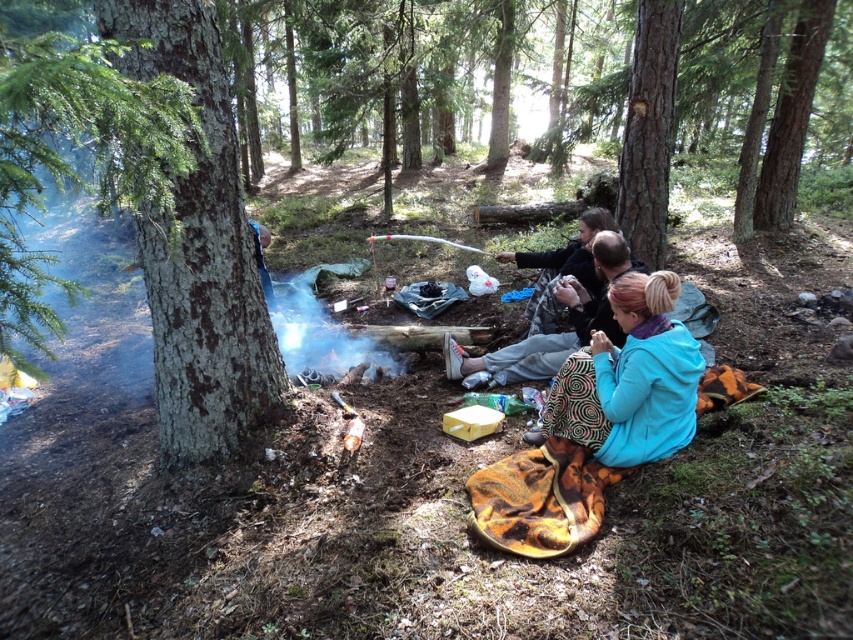
You are a hiker who wants to take a photo of the smooth bark tree at left and the teal fabric jacket at lower right together in the same frame. Based on their positions, will you need to adjust your camera angle to include both?

The smooth bark tree at left is in front of the teal fabric jacket at lower right, so you can capture both in the same frame without needing to adjust your angle since they are aligned along the same line of sight.

From the picture: You are a hiker who wants to grab the matte black jacket at center without moving the teal fabric jacket at lower right. Is this possible?

The teal fabric jacket at lower right is in front of the matte black jacket at center, so you cannot access the matte black jacket at center without moving the teal fabric jacket at lower right.

You are a hiker who just arrived at the campsite and want to check if your teal fabric jacket at lower right is within arm reach. Assuming your arm can reach up to 1.5 meters, can you grab it without moving from your current position?

The teal fabric jacket at lower right is 2.89 meters away from the viewer. Since your arm can only reach up to 1.5 meters, you cannot grab it without moving from your current position.